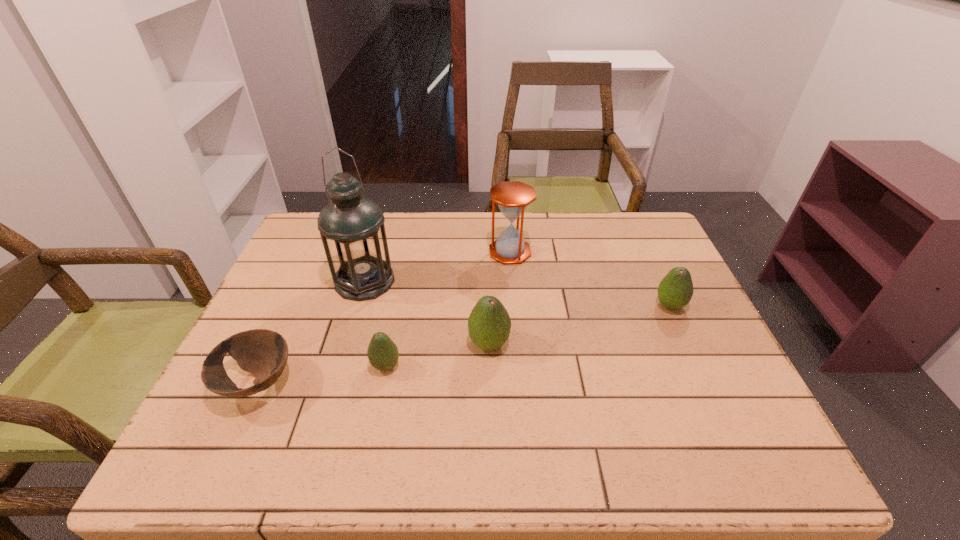
I want to click on vacant space located on the front of the second tallest avocado, so click(x=710, y=395).

This screenshot has width=960, height=540. Find the location of `free space located on the left of the hourglass`. free space located on the left of the hourglass is located at coordinates (366, 252).

At what (x,y) coordinates should I click in order to perform the action: click on free space located on the back of the oil lamp. Please return your answer as a coordinate pair (x, y). The image size is (960, 540). Looking at the image, I should click on (378, 234).

At what (x,y) coordinates should I click in order to perform the action: click on vacant space located on the back of the bowl. Please return your answer as a coordinate pair (x, y). The image size is (960, 540). Looking at the image, I should click on (296, 300).

Image resolution: width=960 pixels, height=540 pixels. What are the coordinates of `object present at the far edge` in the screenshot? It's located at (513, 197).

Image resolution: width=960 pixels, height=540 pixels. I want to click on object at the near edge, so click(264, 353).

This screenshot has width=960, height=540. I want to click on oil lamp present at the left edge, so click(351, 226).

I want to click on bowl located at the left edge, so click(264, 353).

The height and width of the screenshot is (540, 960). In order to click on object that is at the right edge in this screenshot , I will do `click(675, 290)`.

Locate an element on the screen. Image resolution: width=960 pixels, height=540 pixels. object located at the near left corner is located at coordinates (264, 353).